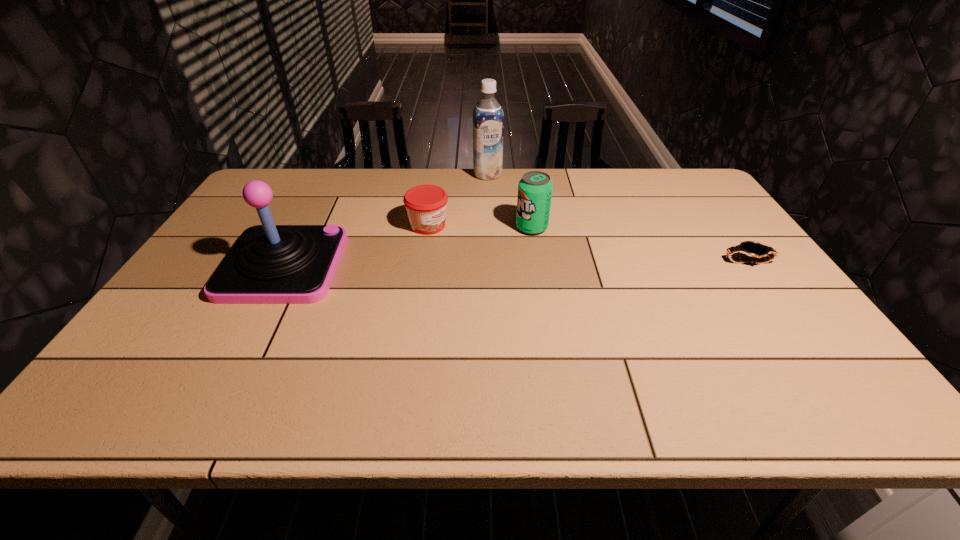
Where is `free area in between the fourth object from left to right and the tallest object`? free area in between the fourth object from left to right and the tallest object is located at coordinates (510, 201).

Locate an element on the screen. free space between the shortest object and the soya milk is located at coordinates (618, 218).

You are a GUI agent. You are given a task and a screenshot of the screen. Output one action in this format:
    pyautogui.click(x=<x>, y=<y>)
    Task: Click on the free spot between the jam and the rightmost object
    
    Given the screenshot: What is the action you would take?
    pyautogui.click(x=588, y=244)

Where is `blank region between the pop soda and the shortest object`? blank region between the pop soda and the shortest object is located at coordinates (640, 245).

Locate an element on the screen. This screenshot has height=540, width=960. blank region between the fourth tallest object and the leftmost object is located at coordinates (356, 245).

Where is `free spot between the shortest object and the leftmost object`? free spot between the shortest object and the leftmost object is located at coordinates (516, 264).

Locate an element on the screen. This screenshot has height=540, width=960. vacant space that is in between the third shortest object and the tallest object is located at coordinates (510, 201).

The height and width of the screenshot is (540, 960). In order to click on vacant space that's between the third shortest object and the watch in this screenshot , I will do [640, 245].

At what (x,y) coordinates should I click in order to perform the action: click on object identified as the third closest to the fourth object from left to right. Please return your answer as a coordinate pair (x, y). This screenshot has height=540, width=960. Looking at the image, I should click on (750, 248).

Identify which object is the third nearest to the soya milk. Please provide its 2D coordinates. Your answer should be formatted as a tuple, i.e. [(x, y)], where the tuple contains the x and y coordinates of a point satisfying the conditions above.

[(269, 264)]